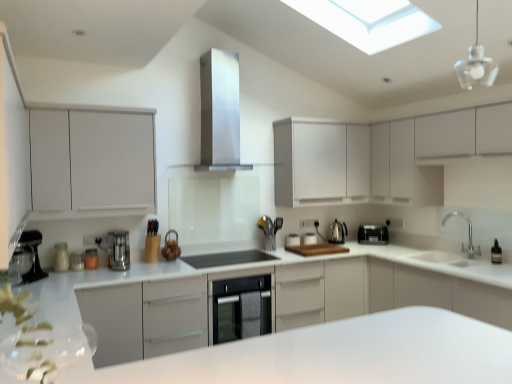
Describe the element at coordinates (227, 258) in the screenshot. I see `black glass cooktop at center, placed as the fourth appliance when sorted from right to left` at that location.

Where is `black plastic toaster at center, positioned as the 1th kitchen appliance in back-to-front order`? The image size is (512, 384). black plastic toaster at center, positioned as the 1th kitchen appliance in back-to-front order is located at coordinates (373, 234).

Describe the element at coordinates (12, 157) in the screenshot. I see `white matte cabinet at left, which is the fourth cabinetry from right to left` at that location.

Measure the distance between point [268,216] and camera.

Point [268,216] is 4.24 meters from camera.

This screenshot has height=384, width=512. What do you see at coordinates (293, 240) in the screenshot? I see `white glossy toaster at center, which is the 2th appliance in right-to-left order` at bounding box center [293, 240].

Locate an element on the screen. white glossy toaster at center, which is the 2th appliance in right-to-left order is located at coordinates (293, 240).

Where is `satin silver coffee machine at left`? satin silver coffee machine at left is located at coordinates (30, 255).

Describe the element at coordinates (30, 255) in the screenshot. Image resolution: width=512 pixels, height=384 pixels. I see `satin silver coffee machine at left` at that location.

Where is `satin silver coffee maker at center, which is counted as the 1th kitchen appliance, starting from the front`? The image size is (512, 384). satin silver coffee maker at center, which is counted as the 1th kitchen appliance, starting from the front is located at coordinates (118, 250).

Is satin steel dishwasher at center touching metallic silver utensil holder at center, placed as the sixth appliance when sorted from left to right?

No, satin steel dishwasher at center is not with metallic silver utensil holder at center, placed as the sixth appliance when sorted from left to right.

From a real-world perspective, between satin steel dishwasher at center and metallic silver utensil holder at center, which is the third appliance in right-to-left order, who is vertically lower?

satin steel dishwasher at center.

Is satin steel dishwasher at center looking in the opposite direction of metallic silver utensil holder at center, which is the third appliance in right-to-left order?

satin steel dishwasher at center does not have its back to metallic silver utensil holder at center, which is the third appliance in right-to-left order.

In the scene shown: What's the angular difference between satin steel dishwasher at center and metallic silver utensil holder at center, placed as the sixth appliance when sorted from left to right,'s facing directions?

The angular difference between satin steel dishwasher at center and metallic silver utensil holder at center, placed as the sixth appliance when sorted from left to right, is 0.694 degrees.

Is satin silver coffee maker at center, which is the 2th kitchen appliance from back to front, oriented towards satin silver coffee machine at left?

No, satin silver coffee maker at center, which is the 2th kitchen appliance from back to front, is not turned towards satin silver coffee machine at left.

From a real-world perspective, relative to satin silver coffee machine at left, is satin silver coffee maker at center, which is the 2th kitchen appliance from back to front, vertically above or below?

Clearly, from a real-world perspective, satin silver coffee maker at center, which is the 2th kitchen appliance from back to front, is below satin silver coffee machine at left.

Which of these two, satin silver coffee maker at center, which is the 2th kitchen appliance from back to front, or satin silver coffee machine at left, is bigger?

Result: satin silver coffee machine at left.

Is white matte cabinet at left, which is the fourth cabinetry from right to left, spatially inside white glossy counter at center, or outside of it?

white matte cabinet at left, which is the fourth cabinetry from right to left, exists outside the volume of white glossy counter at center.

Does white matte cabinet at left, which is the fourth cabinetry from right to left, have a greater height compared to white glossy counter at center?

Yes.

Which of these two, white matte cabinet at left, the 1th cabinetry viewed from the left, or white glossy counter at center, is thinner?

white matte cabinet at left, the 1th cabinetry viewed from the left.

Is white matte cabinet at left, the 1th cabinetry viewed from the left, positioned in front of white glossy counter at center?

No.

From the image's perspective, does transparent glass pendant light at upper right appear higher than white glossy counter at center?

Correct, transparent glass pendant light at upper right appears higher than white glossy counter at center in the image.

In the scene shown: Is transparent glass pendant light at upper right positioned behind white glossy counter at center?

That is True.

Locate an element on the screen. The width and height of the screenshot is (512, 384). counter below the transparent glass pendant light at upper right (from a real-world perspective) is located at coordinates (338, 354).

How many degrees apart are the facing directions of white glossy counter at center and black plastic toaster at center, the second kitchen appliance in the front-to-back sequence?

They differ by 132 degrees in their facing directions.

Which is less distant, (316, 343) or (369, 224)?

The point (316, 343) is in front.

From a real-world perspective, who is located lower, white glossy counter at center or black plastic toaster at center, positioned as the 1th kitchen appliance in back-to-front order?

white glossy counter at center is physically lower.

Considering the sizes of objects white glossy counter at center and black plastic toaster at center, the 1th kitchen appliance when ordered from right to left, in the image provided, who is bigger, white glossy counter at center or black plastic toaster at center, the 1th kitchen appliance when ordered from right to left,?

white glossy counter at center is bigger.

Would you say transparent glass pendant light at upper right is inside or outside white matte cabinet at upper center, the third cabinetry positioned from the left?

transparent glass pendant light at upper right is located beyond the bounds of white matte cabinet at upper center, the third cabinetry positioned from the left.

From a real-world perspective, is transparent glass pendant light at upper right over white matte cabinet at upper center, the second cabinetry positioned from the right?

Yes, from a real-world perspective, transparent glass pendant light at upper right is on top of white matte cabinet at upper center, the second cabinetry positioned from the right.

Between transparent glass pendant light at upper right and white matte cabinet at upper center, the second cabinetry positioned from the right, which one appears on the right side from the viewer's perspective?

From the viewer's perspective, transparent glass pendant light at upper right appears more on the right side.

Based on the photo, which point is more forward, (92, 261) or (403, 131)?

Positioned in front is point (92, 261).

From the image's perspective, relative to white matte cabinet at upper right, the 1th cabinetry viewed from the right, is metallic silver toaster at lower left, which appears as the 6th appliance when viewed from the right, above or below?

Based on their image positions, metallic silver toaster at lower left, which appears as the 6th appliance when viewed from the right, is located beneath white matte cabinet at upper right, the 1th cabinetry viewed from the right.

Can you confirm if metallic silver toaster at lower left, arranged as the third appliance when viewed from the left, is bigger than white matte cabinet at upper right, the 1th cabinetry viewed from the right?

Actually, metallic silver toaster at lower left, arranged as the third appliance when viewed from the left, might be smaller than white matte cabinet at upper right, the 1th cabinetry viewed from the right.

You are a GUI agent. You are given a task and a screenshot of the screen. Output one action in this format:
    pyautogui.click(x=<x>, y=<y>)
    Task: Click on the 1st appliance counting from the right side of the satin steel dishwasher at center
    
    Given the screenshot: What is the action you would take?
    pyautogui.click(x=270, y=230)

Where is `coffee machine in front of the satin silver coffee maker at center, which is counted as the 1th kitchen appliance, starting from the front`? coffee machine in front of the satin silver coffee maker at center, which is counted as the 1th kitchen appliance, starting from the front is located at coordinates (30, 255).

Considering their positions, is metallic silver coffee maker at left, the 8th appliance when ordered from right to left, positioned further to white glossy toaster at center, positioned as the 7th appliance in left-to-right order, than white matte cabinet at upper right, the 1th cabinetry viewed from the right?

metallic silver coffee maker at left, the 8th appliance when ordered from right to left.

When comparing their distances from metallic silver coffee maker at left, marked as the second appliance in a left-to-right arrangement, does black glass cooktop at center, placed as the fourth appliance when sorted from right to left, or white glossy counter at center seem closer?

black glass cooktop at center, placed as the fourth appliance when sorted from right to left.

Based on their spatial positions, is silver metallic faucet at right or transparent glass pendant light at upper right closer to satin steel dishwasher at center?

silver metallic faucet at right lies closer to satin steel dishwasher at center than the other object.

Estimate the real-world distances between objects in this image. Which object is closer to metallic silver coffee maker at left, marked as the second appliance in a left-to-right arrangement, white matte cabinet at upper left, which appears as the third cabinetry when viewed from the right, or white glossy toaster at center, the 1th appliance viewed from the right?

The object closer to metallic silver coffee maker at left, marked as the second appliance in a left-to-right arrangement, is white matte cabinet at upper left, which appears as the third cabinetry when viewed from the right.

From the picture: Which object lies further to the anchor point black plastic toaster at center, the second kitchen appliance in the front-to-back sequence, white matte cabinet at upper center, the third cabinetry positioned from the left, or metallic silver coffee maker at left, which ranks as the seventh appliance in right-to-left order?

metallic silver coffee maker at left, which ranks as the seventh appliance in right-to-left order, is further to black plastic toaster at center, the second kitchen appliance in the front-to-back sequence.

When comparing their distances from satin silver coffee machine at left, does white matte cabinet at upper center, the second cabinetry positioned from the right, or silver metallic faucet at right seem further?

silver metallic faucet at right lies further to satin silver coffee machine at left than the other object.

Based on their spatial positions, is metallic silver coffee maker at left, which ranks as the seventh appliance in right-to-left order, or satin silver coffee maker at center, which is the 2th kitchen appliance from back to front, further from white matte cabinet at upper left, marked as the 2th cabinetry in a left-to-right arrangement?

metallic silver coffee maker at left, which ranks as the seventh appliance in right-to-left order, is further to white matte cabinet at upper left, marked as the 2th cabinetry in a left-to-right arrangement.

Estimate the real-world distances between objects in this image. Which object is further from black plastic toaster at center, positioned as the 1th kitchen appliance in back-to-front order, black glass cooktop at center, placed as the fourth appliance when sorted from right to left, or satin silver coffee maker at center, the first kitchen appliance from the left?

satin silver coffee maker at center, the first kitchen appliance from the left, lies further to black plastic toaster at center, positioned as the 1th kitchen appliance in back-to-front order, than the other object.

Identify the location of dish washer situated between metallic silver toaster at lower left, arranged as the third appliance when viewed from the left, and transparent glass pendant light at upper right from left to right. The width and height of the screenshot is (512, 384). (240, 307).

In order to click on kitchen appliance positioned between white glossy countertop at center and metallic silver coffee maker at left, which ranks as the seventh appliance in right-to-left order, from near to far in this screenshot , I will do `click(118, 250)`.

The image size is (512, 384). What are the coordinates of `coffee machine between white glossy countertop at center and metallic silver coffee maker at left, marked as the second appliance in a left-to-right arrangement, from front to back` in the screenshot? It's located at tap(30, 255).

Locate an element on the screen. tea pot between satin silver coffee machine at left and white matte cabinet at upper right, the 4th cabinetry positioned from the left is located at coordinates (337, 232).